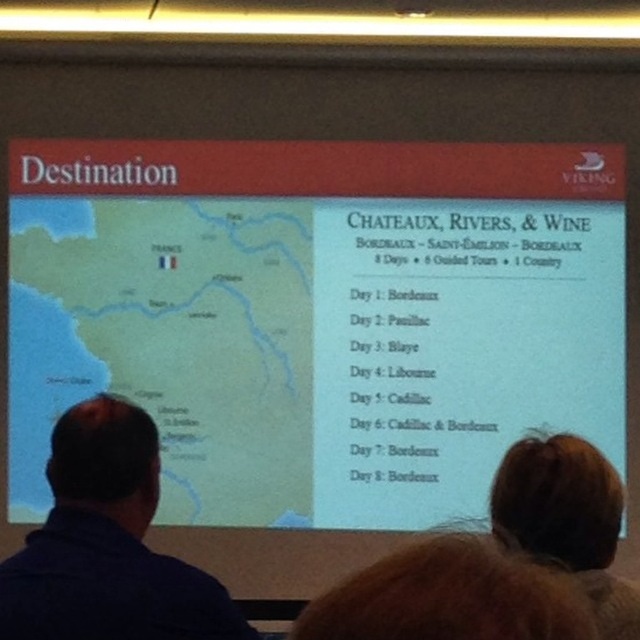
Question: Does blue shirt at left appear over brown hair at upper right?

Choices:
 (A) no
 (B) yes

Answer: (B)

Question: Does blue shirt at left appear over brown hair at upper right?

Choices:
 (A) no
 (B) yes

Answer: (B)

Question: From the image, what is the correct spatial relationship of blue shirt at left in relation to brown hair at upper right?

Choices:
 (A) right
 (B) left

Answer: (B)

Question: Which point is closer to the camera?

Choices:
 (A) (580, 490)
 (B) (225, 618)

Answer: (A)

Question: Which point is farther to the camera?

Choices:
 (A) (83, 540)
 (B) (518, 516)

Answer: (B)